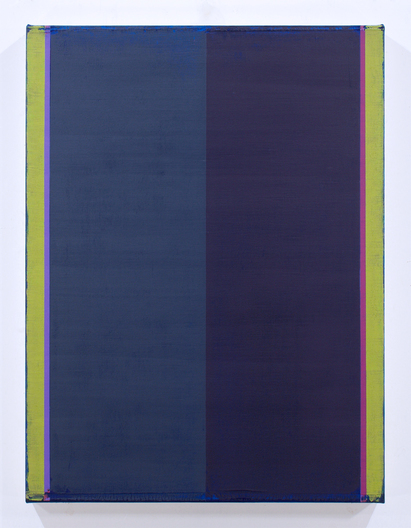
Where is `wall`? This screenshot has height=528, width=411. wall is located at coordinates (9, 459).